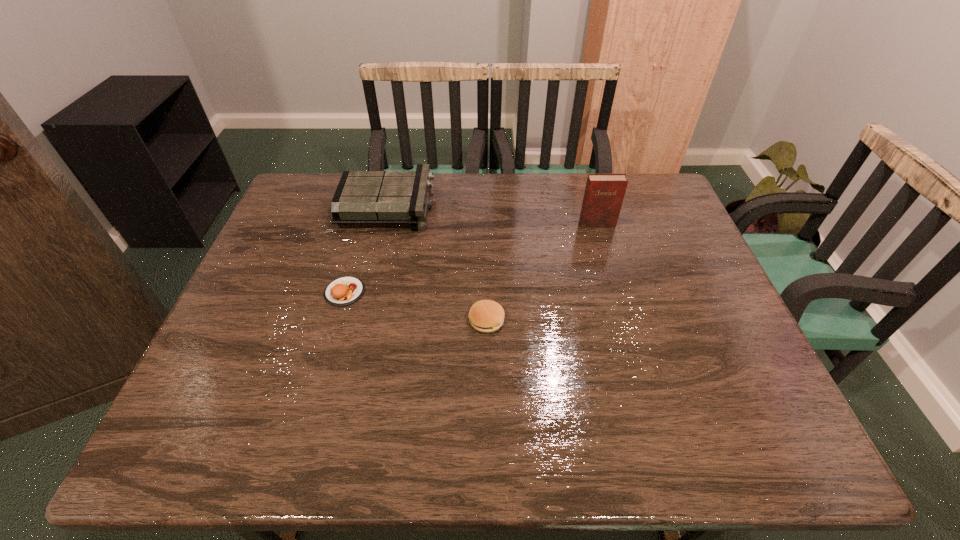
At what (x,y) coordinates should I click in order to perform the action: click on the tallest object. Please return your answer as a coordinate pair (x, y). Looking at the image, I should click on (604, 193).

Find the location of a particular element. The width and height of the screenshot is (960, 540). diary is located at coordinates (604, 193).

At what (x,y) coordinates should I click in order to perform the action: click on radio receiver. Please return your answer as a coordinate pair (x, y). This screenshot has width=960, height=540. Looking at the image, I should click on (362, 197).

Image resolution: width=960 pixels, height=540 pixels. What are the coordinates of `the taller patty (food)` in the screenshot? It's located at (486, 316).

At what (x,y) coordinates should I click in order to perform the action: click on the right patty (food). Please return your answer as a coordinate pair (x, y). The image size is (960, 540). Looking at the image, I should click on (486, 316).

This screenshot has height=540, width=960. I want to click on the left patty (food), so click(343, 291).

Find the location of `the shorter patty (food)`. the shorter patty (food) is located at coordinates (343, 291).

Image resolution: width=960 pixels, height=540 pixels. Find the location of `vacant region located 0.400m on the front cover of the rightmost object`. vacant region located 0.400m on the front cover of the rightmost object is located at coordinates (630, 336).

The height and width of the screenshot is (540, 960). Find the location of `free spot located 0.330m on the front panel of the third shortest object`. free spot located 0.330m on the front panel of the third shortest object is located at coordinates (538, 206).

Locate an element on the screen. The width and height of the screenshot is (960, 540). vacant position located on the back of the third object from left to right is located at coordinates (486, 267).